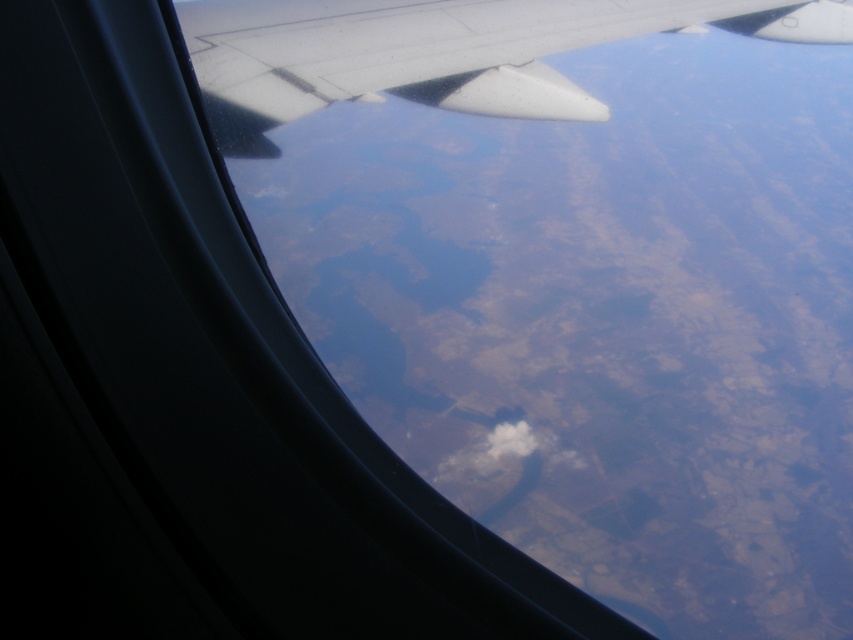
In the scene shown: You are a pilot looking at the airplane window. There is a point marked at coordinates (x=440, y=52). Can you tell me what object is located at that point?

The white matte wing at upper center is located at point (x=440, y=52).

You are a passenger sitting by the window in an airplane. You notice the white matte wing at upper center and the white fluffy cloud at center. Which object is closer to you, the passenger?

The white matte wing at upper center is closer to you because it is positioned in front of the white fluffy cloud at center.